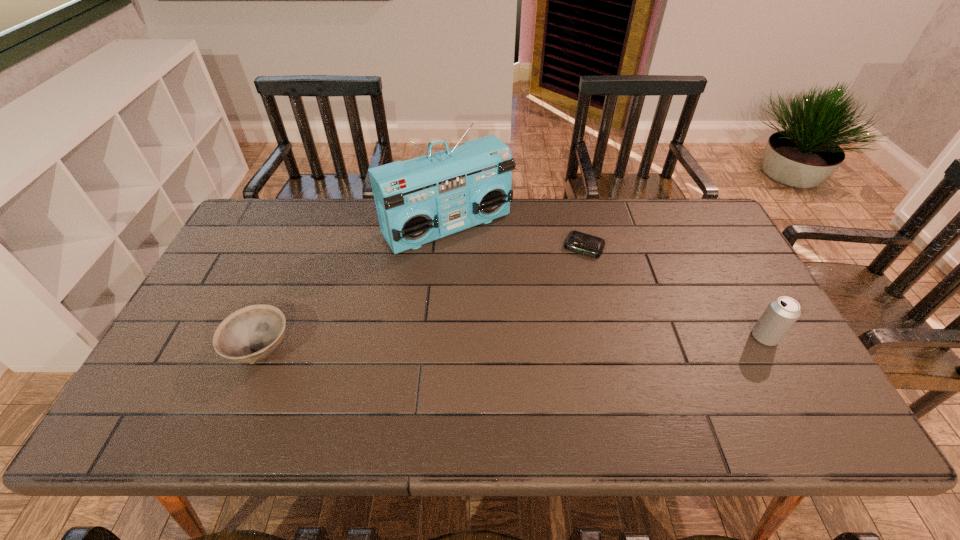
Identify the location of object present at the right edge. (780, 315).

You are a GUI agent. You are given a task and a screenshot of the screen. Output one action in this format:
    pyautogui.click(x=<x>, y=<y>)
    Task: Click on the object that is positioned at the near left corner
    
    Given the screenshot: What is the action you would take?
    pyautogui.click(x=251, y=334)

Identify the location of free space at the far edge of the desktop. The height and width of the screenshot is (540, 960). (348, 219).

Locate an element on the screen. The width and height of the screenshot is (960, 540). vacant space at the near edge of the desktop is located at coordinates (530, 384).

You are a GUI agent. You are given a task and a screenshot of the screen. Output one action in this format:
    pyautogui.click(x=<x>, y=<y>)
    Task: Click on the free space at the left edge of the desktop
    The width and height of the screenshot is (960, 540).
    Given the screenshot: What is the action you would take?
    [203, 348]

Image resolution: width=960 pixels, height=540 pixels. I want to click on vacant space at the right edge of the desktop, so click(x=709, y=291).

At what (x,y) coordinates should I click in order to perform the action: click on free space at the far left corner of the desktop. Please return your answer as a coordinate pair (x, y). Looking at the image, I should click on (283, 226).

I want to click on free space between the third object from right to left and the third shortest object, so click(x=606, y=282).

Identify the location of empty location between the bowl and the second object from right to left. The height and width of the screenshot is (540, 960). (422, 299).

I want to click on free space between the radio receiver and the shortest object, so click(x=516, y=237).